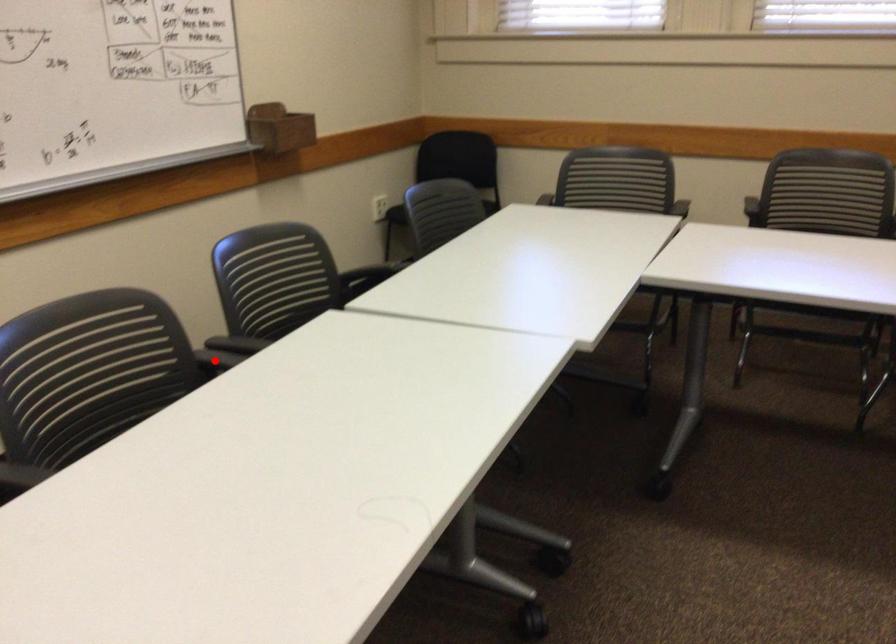
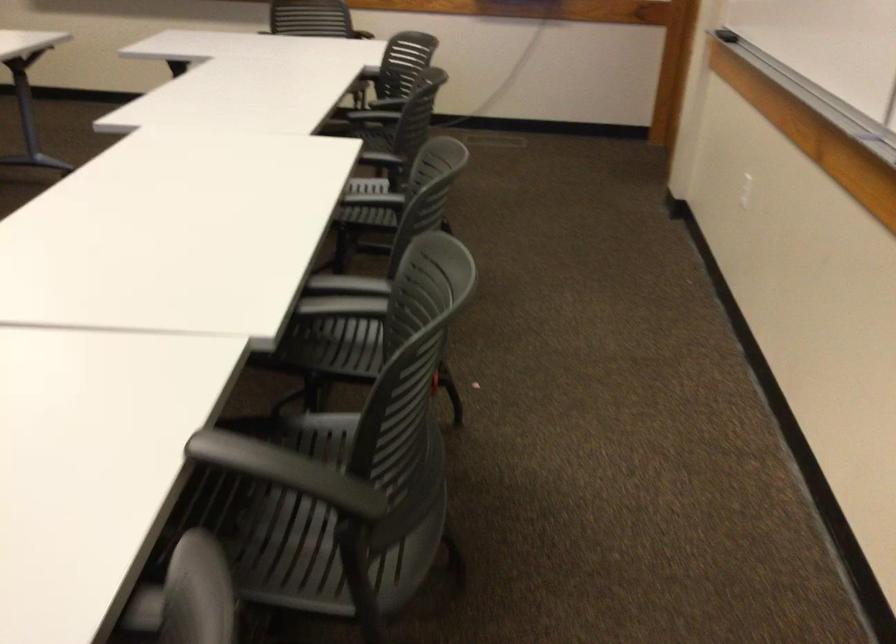
Question: I am providing you with two images of the same scene from different viewpoints. Image1 has a red point marked. In image2, the corresponding 3D location appears at what relative position? Reply with the corresponding letter.

Choices:
 (A) Closer
 (B) Farther

Answer: (A)